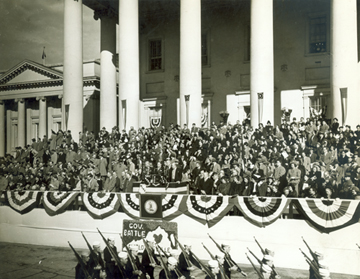
I want to click on columns, so click(345, 72), click(262, 111), click(195, 111), click(136, 114), click(106, 113), click(77, 128), click(41, 117), click(20, 129), click(4, 131).